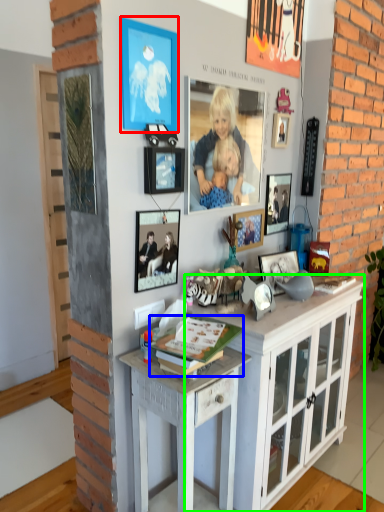
Question: Which object is positioned closest to picture frame (highlighted by a red box)? Select from magazine (highlighted by a blue box) and cabinetry (highlighted by a green box).

Choices:
 (A) magazine
 (B) cabinetry

Answer: (A)